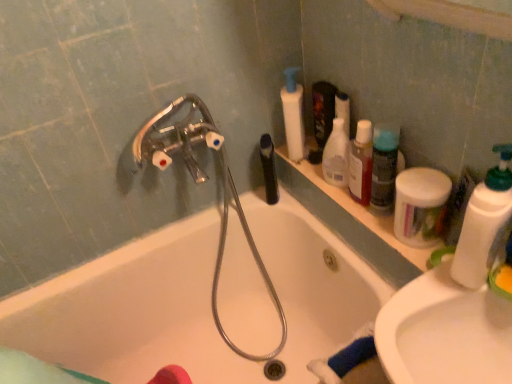
The height and width of the screenshot is (384, 512). I want to click on empty space that is ontop of white plastic bottles at upper right, so click(337, 186).